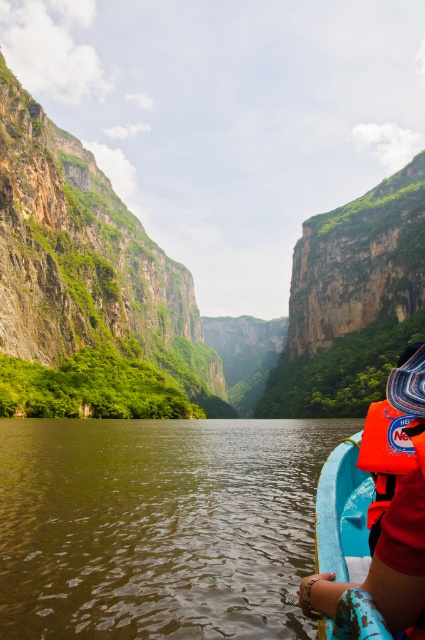
Question: Is orange life vest at lower right positioned behind orange fabric life jacket at right?

Choices:
 (A) yes
 (B) no

Answer: (B)

Question: Is orange life vest at lower right positioned at the back of orange fabric life jacket at right?

Choices:
 (A) no
 (B) yes

Answer: (A)

Question: Among these points, which one is farthest from the camera?

Choices:
 (A) tap(422, 609)
 (B) tap(388, 451)

Answer: (B)

Question: Is orange life vest at lower right closer to camera compared to orange fabric life jacket at right?

Choices:
 (A) no
 (B) yes

Answer: (B)